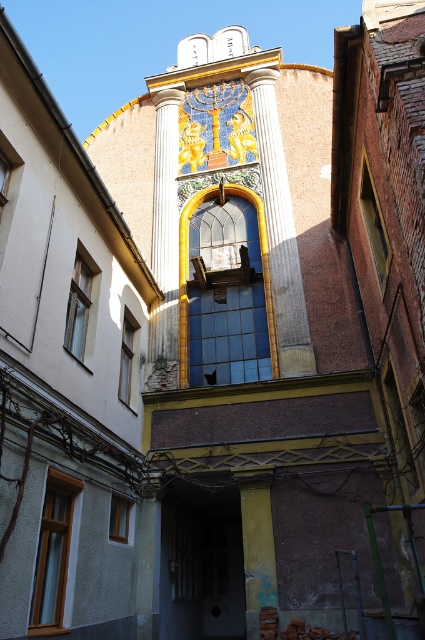
Who is more forward, (269,243) or (175,321)?

Point (175,321) is more forward.

Does point (277, 147) lie in front of point (166, 352)?

No, it is not.

Where is `white marble column at center`? This screenshot has width=425, height=640. white marble column at center is located at coordinates (280, 230).

Is gold textured column at center positioned in front of yellow painted wood at center?

No, it is behind yellow painted wood at center.

Identify the location of gold textured column at center. The width and height of the screenshot is (425, 640). (164, 243).

Which is more to the left, white marble column at center or yellow painted wood at center?

yellow painted wood at center is more to the left.

Which of these two, white marble column at center or yellow painted wood at center, stands taller?

Standing taller between the two is white marble column at center.

Where is `white marble column at center`? The width and height of the screenshot is (425, 640). white marble column at center is located at coordinates (280, 230).